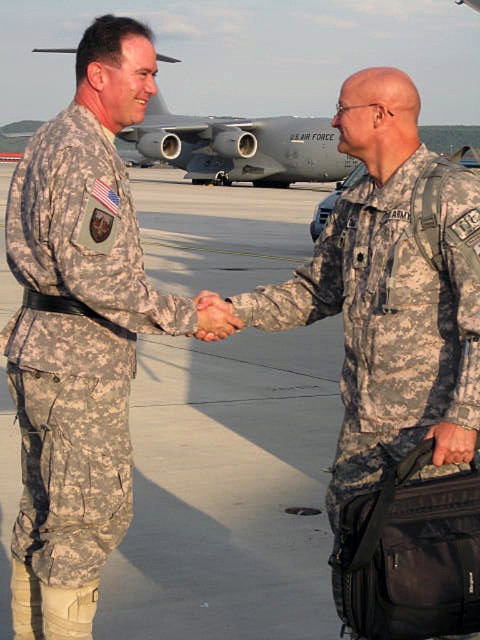
Question: Is the position of camouflage fabric pants at left more distant than that of camouflage fabric handshake at center?

Choices:
 (A) no
 (B) yes

Answer: (A)

Question: Among these objects, which one is farthest from the camera?

Choices:
 (A) camouflage fabric handshake at center
 (B) camouflage fabric pants at left

Answer: (A)

Question: Is camouflage fabric pants at left to the right of camouflage fabric handshake at center from the viewer's perspective?

Choices:
 (A) yes
 (B) no

Answer: (B)

Question: Which of the following is the farthest from the observer?

Choices:
 (A) (108, 483)
 (B) (207, 321)

Answer: (A)

Question: Is camouflage fabric pants at left wider than camouflage fabric handshake at center?

Choices:
 (A) yes
 (B) no

Answer: (A)